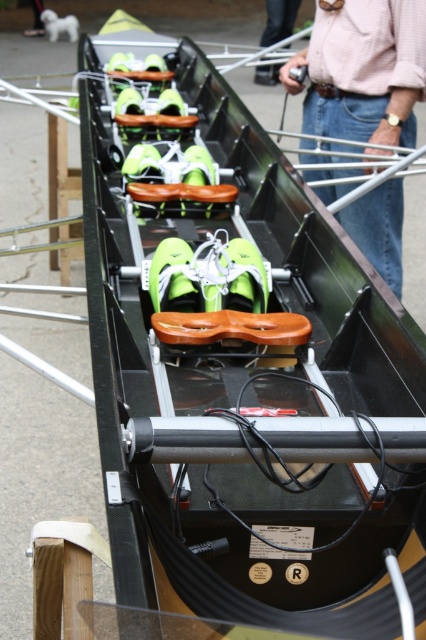
You are an athlete preparing for a competition and notice two pink shirts in the image. Both are labeled as pink shirt at upper center and pink fabric shirt at upper center. Which one is wider?

The pink shirt at upper center is wider than the pink fabric shirt at upper center according to the description.